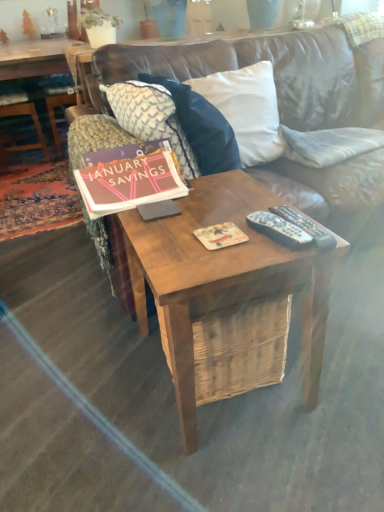
Question: Is white fabric pillow at upper right, the third pillow in the left-to-right sequence, wider or thinner than black plastic remote controls at center, the 2th remote control from the left?

Choices:
 (A) wide
 (B) thin

Answer: (A)

Question: Relative to black plastic remote controls at center, arranged as the 1th remote control when viewed from the right, is white fabric pillow at upper right, the third pillow in the left-to-right sequence, in front or behind?

Choices:
 (A) front
 (B) behind

Answer: (B)

Question: Considering the real-world distances, which object is farthest from the matte pink paper at center?

Choices:
 (A) wooden table at center
 (B) white fabric pillow at upper center, which appears as the 2th pillow when viewed from the left
 (C) black plastic remote controls at center, the 2th remote control from the left
 (D) patterned fabric pillow at center, positioned as the third pillow in right-to-left order
 (E) white fabric pillow at upper right, the third pillow in the left-to-right sequence

Answer: (E)

Question: Estimate the real-world distances between objects in this image. Which object is farther from the matte cardboard magazine at center?

Choices:
 (A) wooden table at center
 (B) patterned fabric pillow at center, the first pillow in the left-to-right sequence
 (C) black plastic remote controls at center, arranged as the 1th remote control when viewed from the right
 (D) black plastic remote controls at center, placed as the 1th remote control when sorted from left to right
 (E) white fabric pillow at upper center, which appears as the 2th pillow when viewed from the left

Answer: (E)